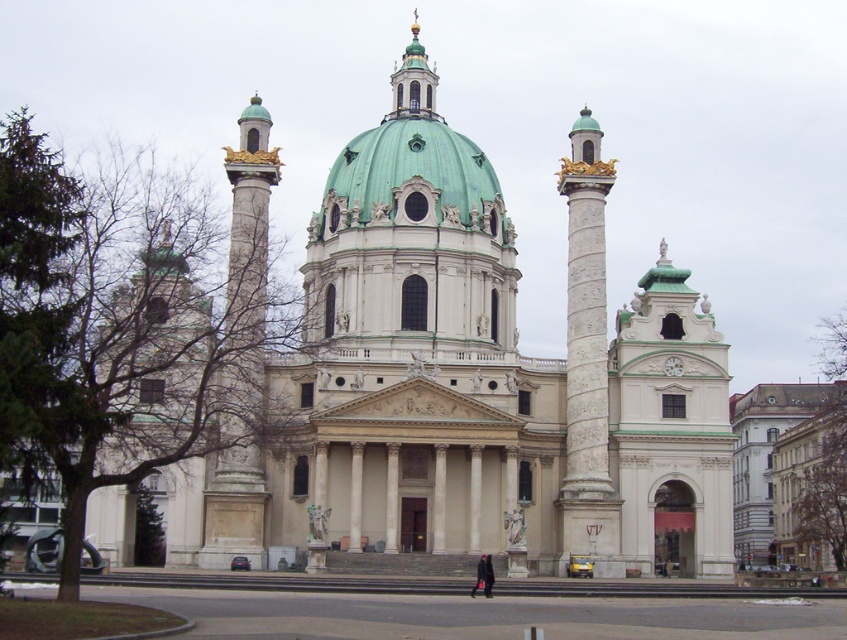
You are an architect visiting the church and need to determine the scale of the structures. Which object, the white stone church at center or the white marble column at right, would require more materials to construct based on their sizes?

The white stone church at center is bigger than the white marble column at right, so it would require more materials to construct.

You are a delivery person with a cart that is 4 meters wide. You need to move your cart from the parking lot to the entrance of the white stone church at center. There is a white marble column at right in the way. Can your cart fit through the space between the column and the church?

The distance between the white stone church at center and the white marble column at right is 8.67 meters. Since your cart is only 4 meters wide, there is enough space for the cart to pass through the gap between them.